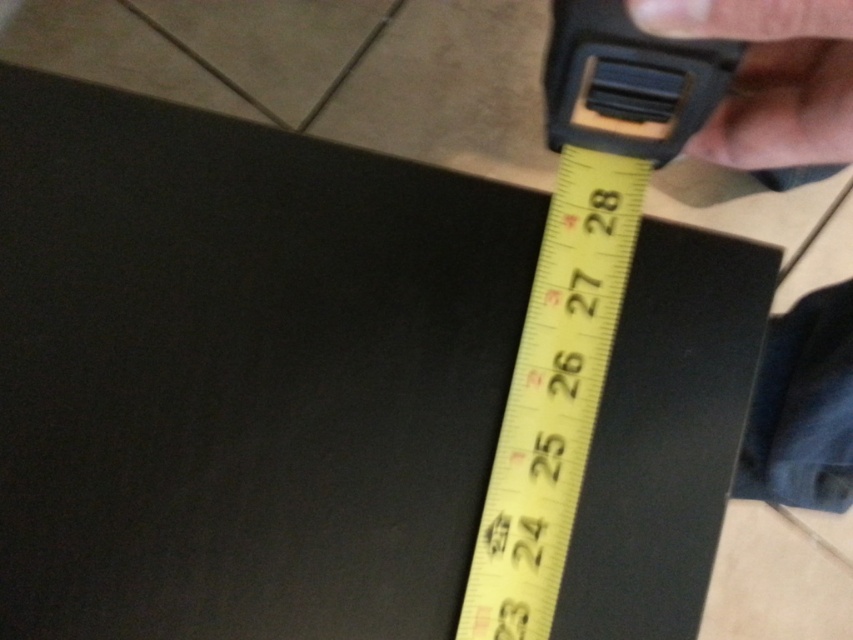
You are a contractor measuring a black rectangular object with a yellow tape measure. You notice two points labeled as point (711, 100) and point (804, 477) on the object. Which point is nearer to your eyes?

Point (711, 100) is closer to the viewer than point (804, 477).

You are a robot trying to place a tool on the floor in the image. The tool must be placed exactly where the skinny hand at upper right is currently located. Is this possible?

The skinny hand at upper right is located at point (x=770, y=77), so yes, the robot can place the tool there as it is within the frame.